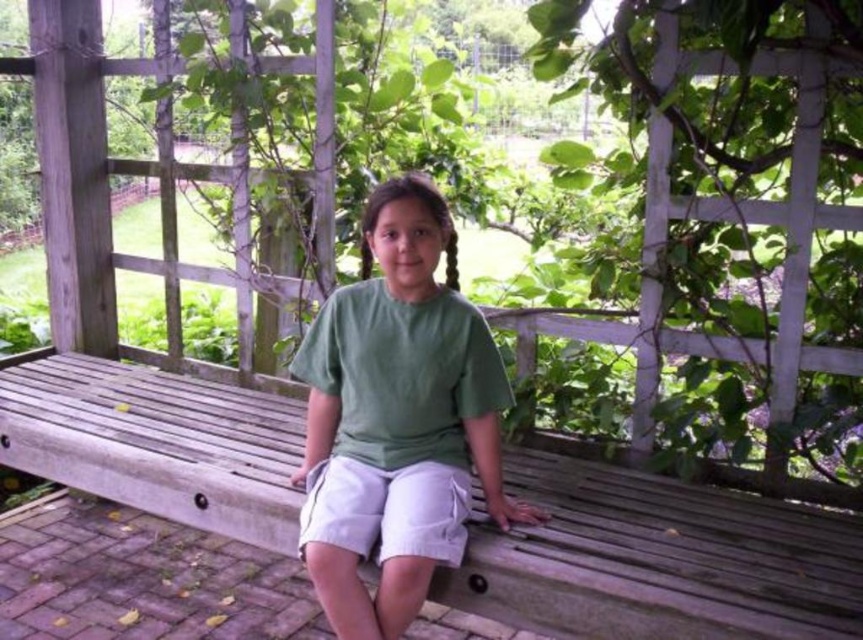
Question: Does wooden bench at center come in front of green cotton shirt at center?

Choices:
 (A) no
 (B) yes

Answer: (A)

Question: Which point is farther to the camera?

Choices:
 (A) wooden bench at center
 (B) green cotton shirt at center

Answer: (A)

Question: Which point is closer to the camera?

Choices:
 (A) (298, 493)
 (B) (339, 589)

Answer: (B)

Question: Which of the following is the farthest from the observer?

Choices:
 (A) (751, 516)
 (B) (502, 392)

Answer: (B)

Question: Observing the image, what is the correct spatial positioning of wooden bench at center in reference to green cotton shirt at center?

Choices:
 (A) below
 (B) above

Answer: (A)

Question: Is wooden bench at center positioned behind green cotton shirt at center?

Choices:
 (A) no
 (B) yes

Answer: (B)